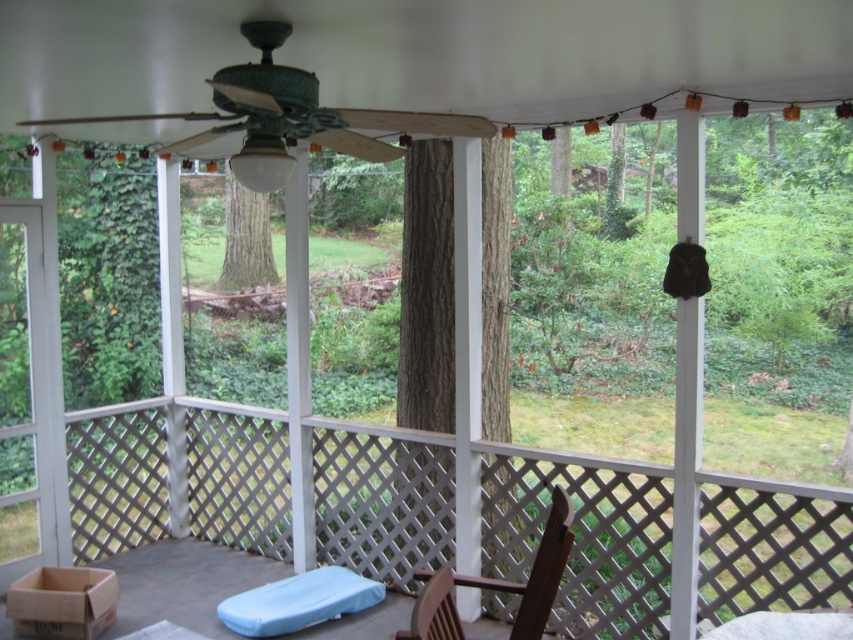
Can you confirm if wooden rocking chair at center is wider than clear glass door at left?

Correct, the width of wooden rocking chair at center exceeds that of clear glass door at left.

Which is behind, point (596, 557) or point (27, 496)?

The point (27, 496) is more distant.

Locate an element on the screen. This screenshot has width=853, height=640. wooden rocking chair at center is located at coordinates (584, 536).

Does clear glass door at left have a greater height compared to brown wooden chair at center?

Correct, clear glass door at left is much taller as brown wooden chair at center.

Can you confirm if clear glass door at left is shorter than brown wooden chair at center?

Incorrect, clear glass door at left's height does not fall short of brown wooden chair at center's.

Between point (39, 250) and point (421, 570), which one is positioned in front?

Positioned in front is point (421, 570).

What are the coordinates of `clear glass door at left` in the screenshot? It's located at pyautogui.click(x=33, y=394).

Can you confirm if wooden rocking chair at center is smaller than brown wooden chair at center?

No, wooden rocking chair at center is not smaller than brown wooden chair at center.

Between wooden rocking chair at center and brown wooden chair at center, which one appears on the left side from the viewer's perspective?

wooden rocking chair at center is more to the left.

Which is behind, point (717, 573) or point (421, 604)?

Positioned behind is point (717, 573).

This screenshot has width=853, height=640. What are the coordinates of `wooden rocking chair at center` in the screenshot? It's located at (584, 536).